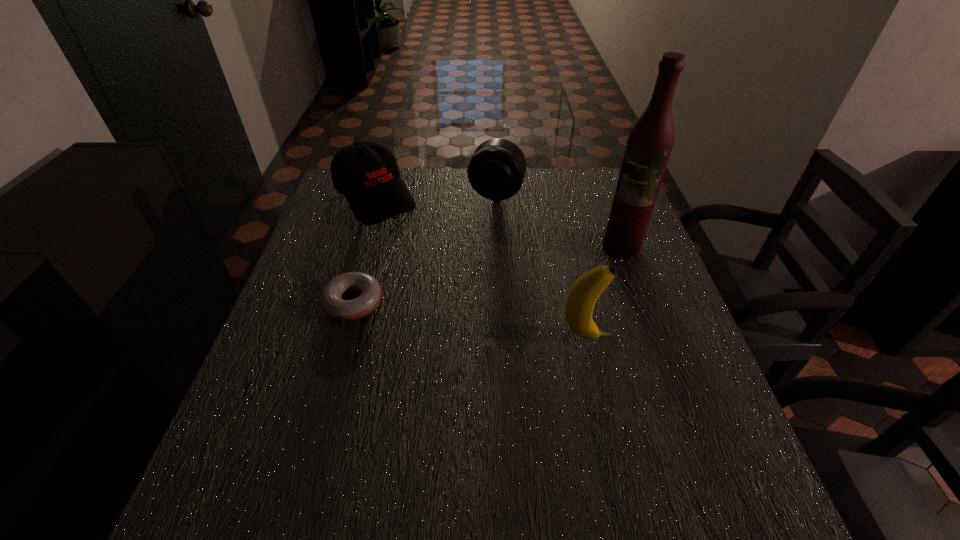
I want to click on doughnut, so click(x=331, y=302).

Identify the location of the shortest object. (331, 302).

Identify the location of banana. (583, 294).

This screenshot has width=960, height=540. I want to click on the second tallest object, so pos(583,294).

At what (x,y) coordinates should I click in order to perform the action: click on baseball cap. Please return your answer as a coordinate pair (x, y). The height and width of the screenshot is (540, 960). Looking at the image, I should click on (367, 173).

Find the location of a particular element. The height and width of the screenshot is (540, 960). the third object from right to left is located at coordinates (496, 171).

The width and height of the screenshot is (960, 540). Find the location of `the tallest object`. the tallest object is located at coordinates (650, 141).

Find the location of a particular element. liquor is located at coordinates (650, 141).

This screenshot has height=540, width=960. In order to click on vacant space situated 0.260m on the front of the shortest object in this screenshot , I will do `click(316, 436)`.

Where is `vacant space located 0.160m from the stem of the second tallest object`? vacant space located 0.160m from the stem of the second tallest object is located at coordinates (688, 338).